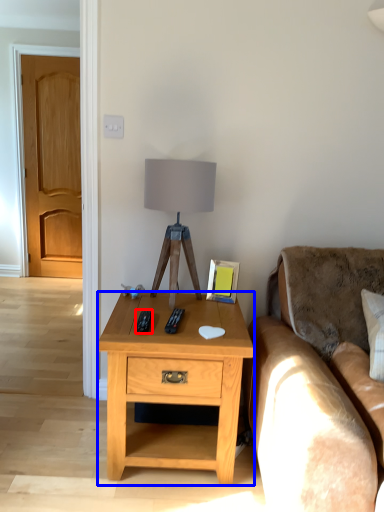
Question: Which point is closer to the camera, remote (highlighted by a red box) or desk (highlighted by a blue box)?

Choices:
 (A) remote
 (B) desk

Answer: (B)